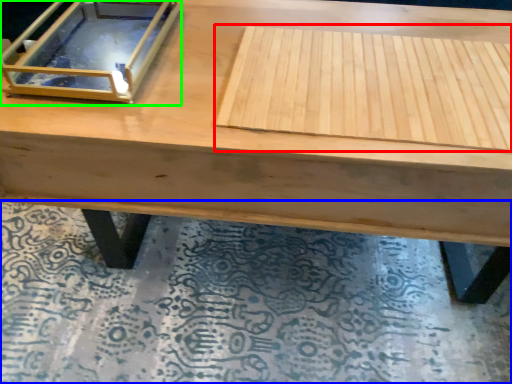
Question: Based on their relative distances, which object is nearer to plywood (highlighted by a red box)? Choose from mat (highlighted by a blue box) and glass box (highlighted by a green box).

Choices:
 (A) mat
 (B) glass box

Answer: (B)